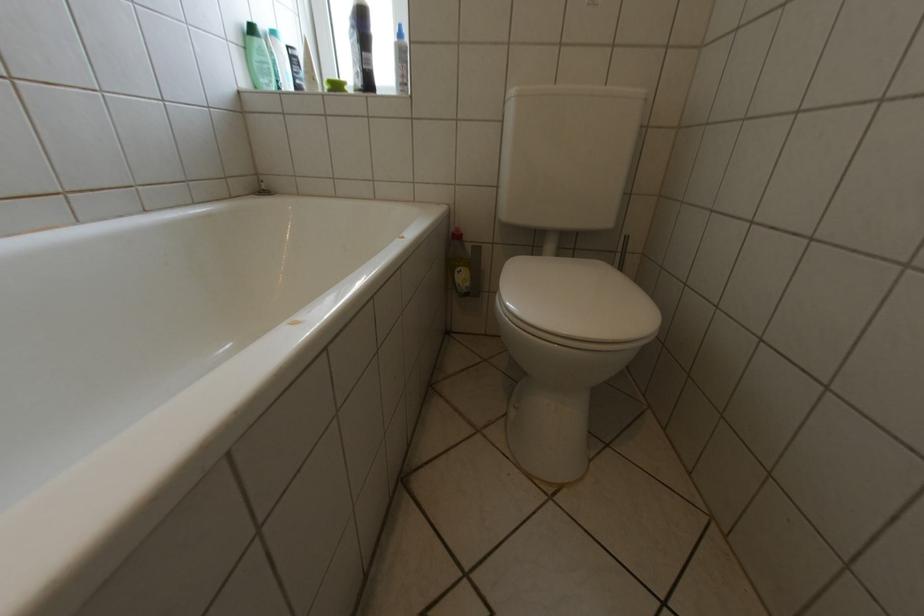
Identify the location of white toilet lid. (578, 300).